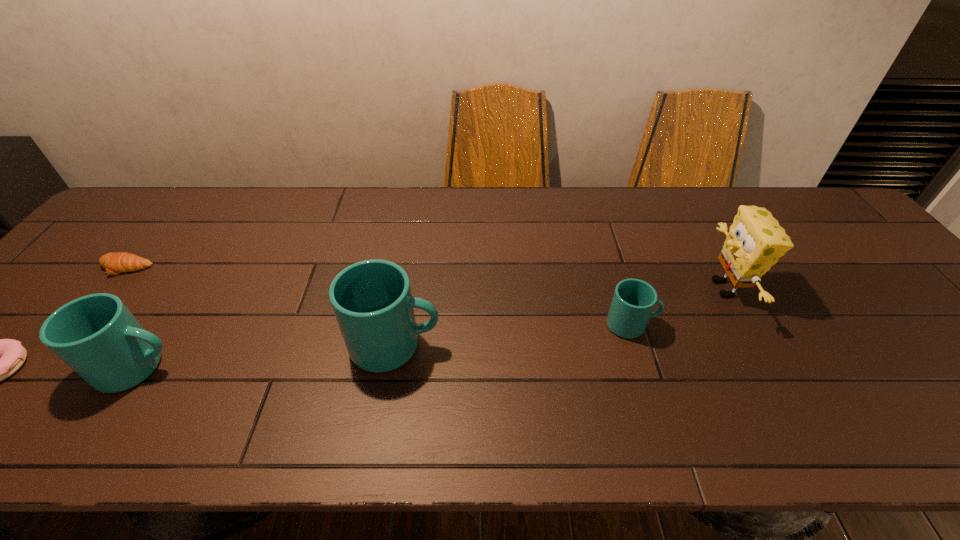
At what (x,y) coordinates should I click in order to perform the action: click on the second shortest cup. Please return your answer as a coordinate pair (x, y). Image resolution: width=960 pixels, height=540 pixels. Looking at the image, I should click on (96, 335).

Locate an element on the screen. The height and width of the screenshot is (540, 960). the fourth object from right to left is located at coordinates (96, 335).

Identify the location of the second cup from right to left. (372, 301).

The width and height of the screenshot is (960, 540). I want to click on the rightmost cup, so click(x=632, y=305).

What are the coordinates of `the shortest cup` in the screenshot? It's located at (632, 305).

You are a GUI agent. You are given a task and a screenshot of the screen. Output one action in this format:
    pyautogui.click(x=<x>, y=<y>)
    Task: Click on the rightmost object
    This screenshot has height=540, width=960.
    Given the screenshot: What is the action you would take?
    pyautogui.click(x=755, y=241)

Where is `crescent roll`? crescent roll is located at coordinates (114, 263).

The width and height of the screenshot is (960, 540). I want to click on vacant space located 0.260m on the handle side of the third object from left to right, so tap(299, 368).

Locate an element on the screen. The image size is (960, 540). free location located on the handle side of the second cup from right to left is located at coordinates (568, 346).

Identify the location of vacant area located 0.100m on the handle side of the fifth object from left to right. (699, 325).